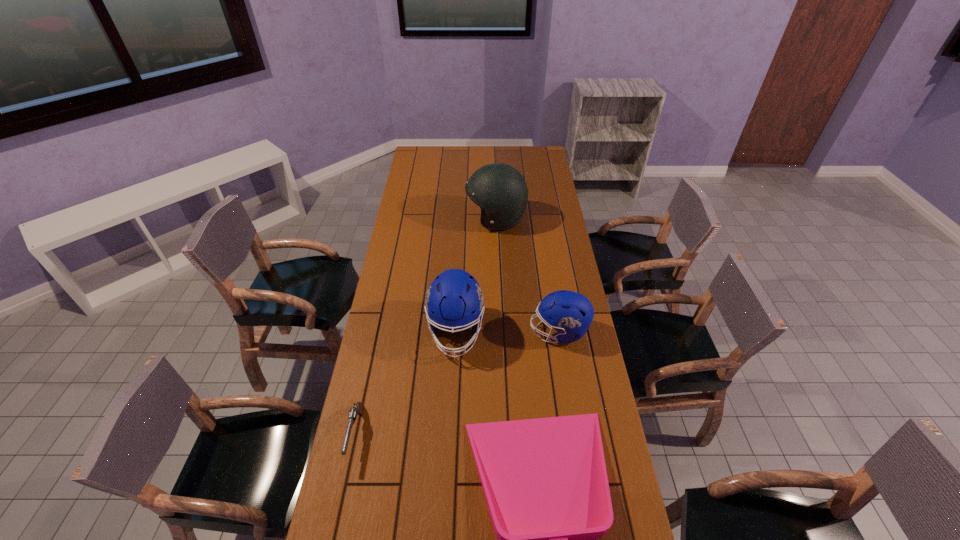
The width and height of the screenshot is (960, 540). What are the coordinates of `vacant space located aiming along the barrel of the leftmost object` in the screenshot? It's located at (338, 515).

I want to click on object at the left edge, so click(x=358, y=408).

This screenshot has height=540, width=960. What are the coordinates of `object that is at the right edge` in the screenshot? It's located at (570, 313).

In the image, there is a desktop. Identify the location of free region at the left edge. The image size is (960, 540). (419, 236).

Identify the location of vacant area at the right edge of the desktop. The image size is (960, 540). (561, 248).

Where is `vacant space at the far left corner of the desktop`? vacant space at the far left corner of the desktop is located at coordinates (422, 152).

Where is `free point between the farthest football helmet and the third shortest object`? The height and width of the screenshot is (540, 960). free point between the farthest football helmet and the third shortest object is located at coordinates (527, 275).

Find the location of `free space between the leftmost object and the shortest football helmet`. free space between the leftmost object and the shortest football helmet is located at coordinates (457, 383).

Locate an element on the screen. The width and height of the screenshot is (960, 540). free space between the farthest object and the shortest football helmet is located at coordinates (527, 275).

This screenshot has width=960, height=540. What are the coordinates of `object that can be found as the second closest to the farthest football helmet` in the screenshot? It's located at (570, 313).